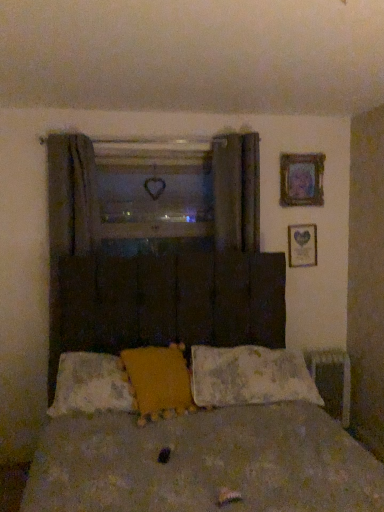
Question: Does point (291, 198) appear closer or farther from the camera than point (185, 210)?

Choices:
 (A) farther
 (B) closer

Answer: (B)

Question: Is wooden picture frame at upper right, which is the second picture frame in bottom-to-top order, in front of or behind wooden frame at center in the image?

Choices:
 (A) behind
 (B) front

Answer: (A)

Question: Estimate the real-world distances between objects in this image. Which object is closer to the wooden picture frame at upper right, the first picture frame positioned from the bottom?

Choices:
 (A) textured brown bed at center
 (B) fluffy white pillow at center, acting as the 3th pillow starting from the right
 (C) yellow fabric pillow at center, positioned as the 2th pillow in left-to-right order
 (D) wooden picture frame at upper right, which is the 1th picture frame from top to bottom
 (E) dark fabric curtain at upper center, which is counted as the first curtain, starting from the right

Answer: (D)

Question: Which object is the closest to the fluffy white pillow at center, acting as the first pillow starting from the right?

Choices:
 (A) wooden picture frame at upper right, which is the second picture frame in bottom-to-top order
 (B) metallic gray radiator at lower right
 (C) dark fabric curtain at upper center, which is counted as the first curtain, starting from the right
 (D) textured brown bed at center
 (E) wooden frame at center

Answer: (D)